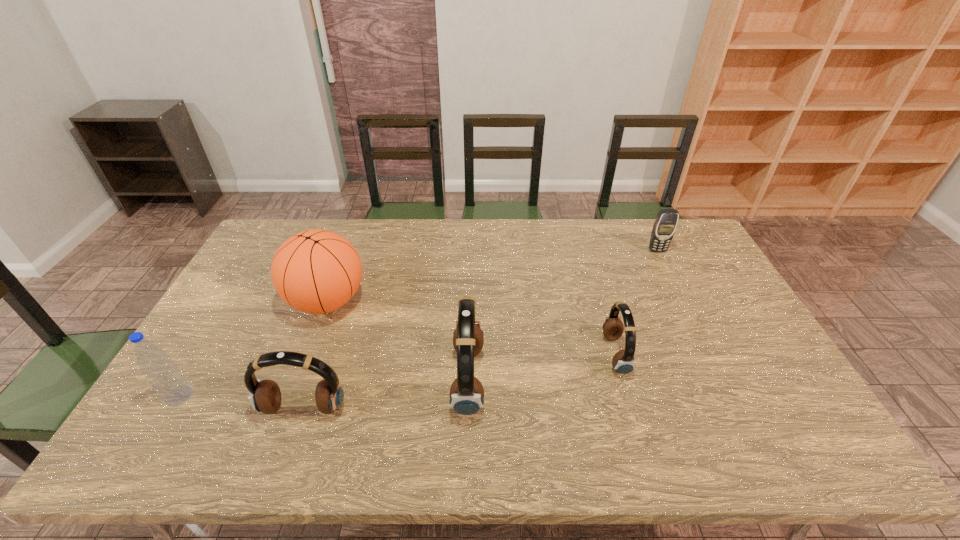
The height and width of the screenshot is (540, 960). Find the location of `the leftmost headset`. the leftmost headset is located at coordinates (265, 396).

I want to click on the second headset from right to left, so click(466, 394).

Identify the location of the tallest headset. (466, 394).

Where is `the second object from right to left`? This screenshot has width=960, height=540. the second object from right to left is located at coordinates (623, 362).

Where is `the rightmost headset`? the rightmost headset is located at coordinates (623, 362).

Where is `the rightmost object`? This screenshot has width=960, height=540. the rightmost object is located at coordinates (664, 227).

Identify the location of cellular telephone. The image size is (960, 540). (664, 227).

The width and height of the screenshot is (960, 540). I want to click on basketball, so [x=317, y=271].

This screenshot has height=540, width=960. I want to click on water bottle, so click(x=164, y=376).

You are a GUI agent. You are given a task and a screenshot of the screen. Output one action in this format:
    pyautogui.click(x=<x>, y=<y>)
    Task: Click on the vacant space located on the ear cup of the tallest headset
    The width and height of the screenshot is (960, 540).
    Given the screenshot: What is the action you would take?
    pyautogui.click(x=614, y=380)